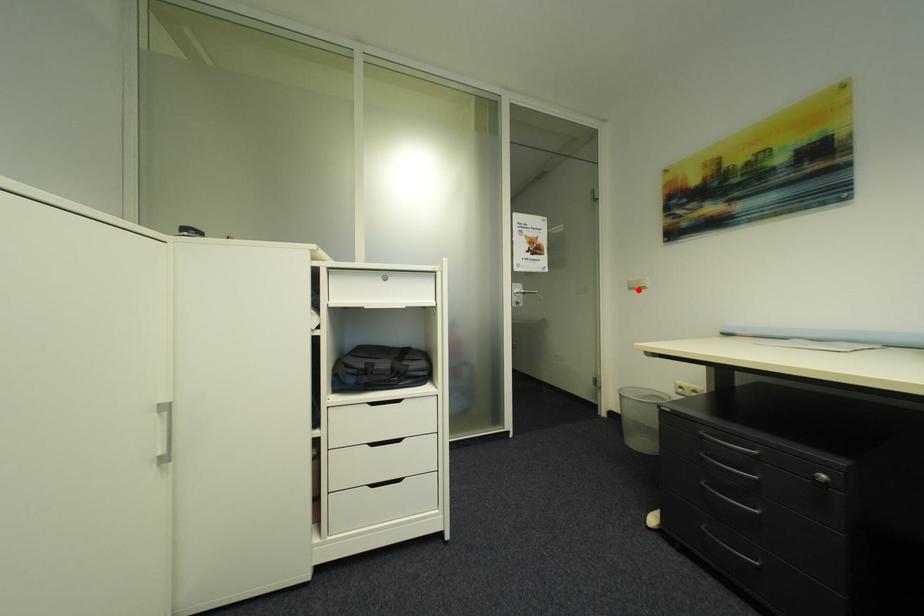
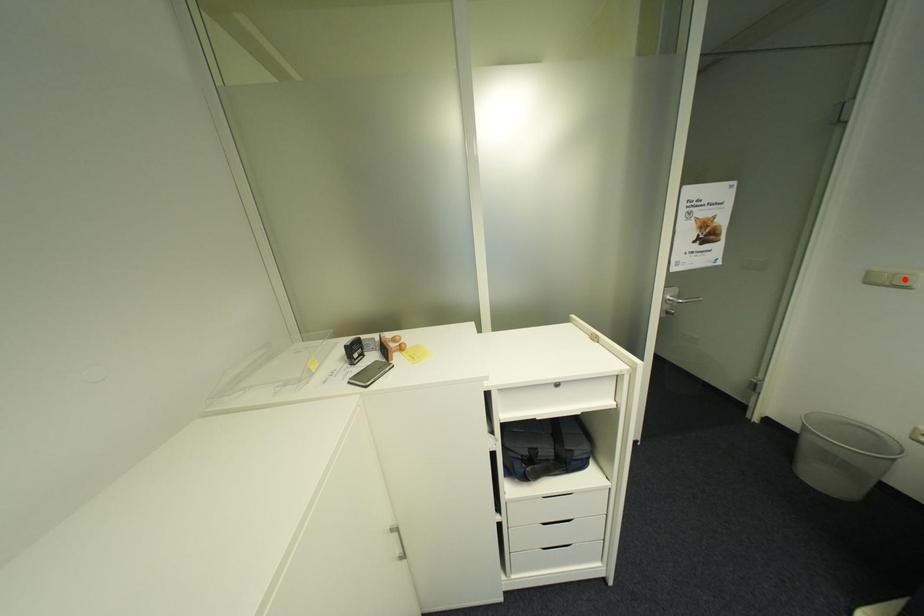
I am providing you with two images of the same scene from different viewpoints. A red point is marked on the first image and another point is marked on the second image. Is the marked point in image1 the same physical position as the marked point in image2?

No